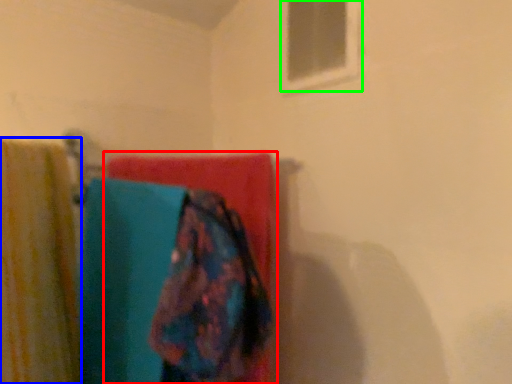
Question: Which object is the farthest from towel (highlighted by a red box)? Choose among these: curtain (highlighted by a blue box) or window (highlighted by a green box).

Choices:
 (A) curtain
 (B) window

Answer: (B)